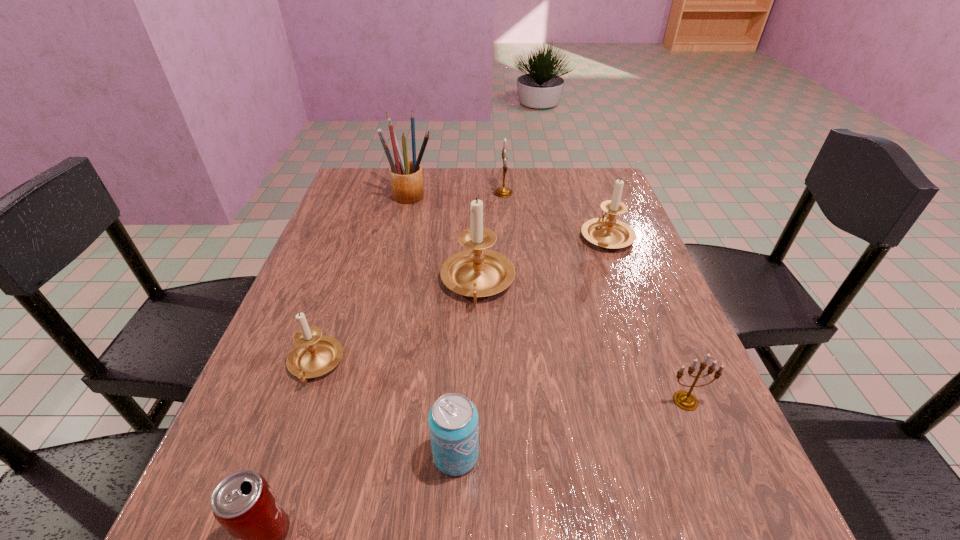
The image size is (960, 540). In order to click on pencil box in this screenshot , I will do `click(406, 177)`.

I want to click on the third farthest candelabrum, so click(x=476, y=272).

This screenshot has width=960, height=540. In order to click on the fifth nearest object in this screenshot , I will do `click(476, 272)`.

The image size is (960, 540). Find the location of `the second farthest candelabrum`. the second farthest candelabrum is located at coordinates [x=609, y=232].

Locate an element on the screen. This screenshot has height=540, width=960. the third farthest object is located at coordinates (609, 232).

At what (x,y) coordinates should I click in order to perform the action: click on the farther gold candelabrum. Please return your answer as a coordinate pair (x, y). Looking at the image, I should click on (503, 192).

Image resolution: width=960 pixels, height=540 pixels. Identify the location of the bigger gold candelabrum. (503, 192).

Locate an element on the screen. Image resolution: width=960 pixels, height=540 pixels. the leftmost beige candle holder is located at coordinates (314, 355).

Identify the location of the nearest beige candle holder. (314, 355).

Find the location of `the right gold candelabrum`. the right gold candelabrum is located at coordinates (685, 400).